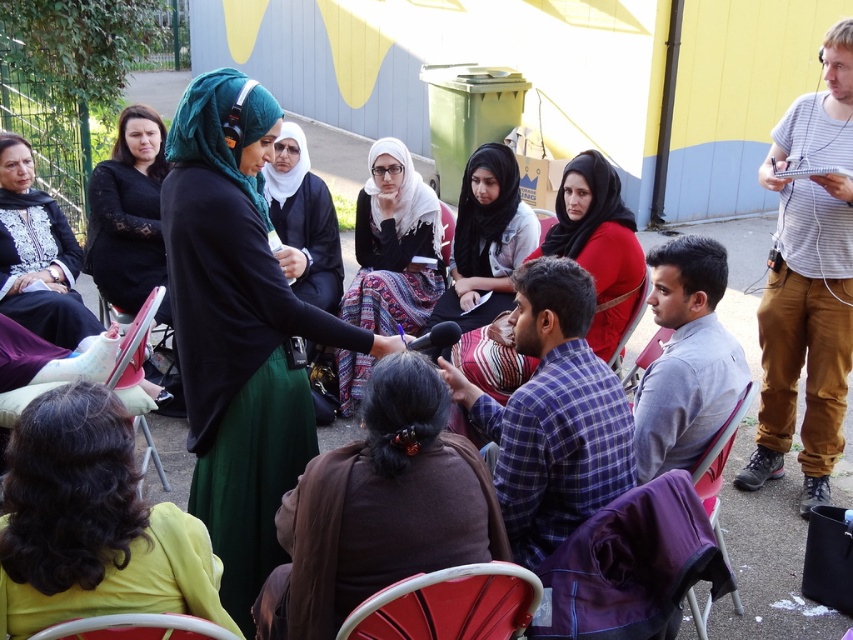
Question: Among these objects, which one is farthest from the camera?

Choices:
 (A) curly hair at lower left
 (B) matte black hijab at center

Answer: (B)

Question: Does purple fabric chair at lower center appear on the left side of black lace dress at center?

Choices:
 (A) yes
 (B) no

Answer: (B)

Question: Which object is closer to the camera taking this photo?

Choices:
 (A) curly hair at lower left
 (B) black lace dress at left
 (C) purple fabric chair at lower center
 (D) patterned fabric hijab at center

Answer: (A)

Question: Is patterned fabric hijab at center smaller than black lace dress at left?

Choices:
 (A) yes
 (B) no

Answer: (A)

Question: Does green matte hijab at center have a smaller size compared to plastic chair at lower left?

Choices:
 (A) no
 (B) yes

Answer: (A)

Question: Which object is closer to the camera taking this photo?

Choices:
 (A) black lace dress at left
 (B) brown fabric at center
 (C) plastic chair at lower left

Answer: (C)